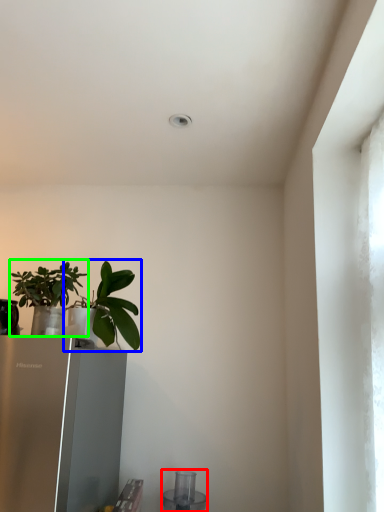
Question: Which object is the closest to the appliance (highlighted by a red box)? Choose among these: houseplant (highlighted by a blue box) or houseplant (highlighted by a green box).

Choices:
 (A) houseplant
 (B) houseplant

Answer: (A)